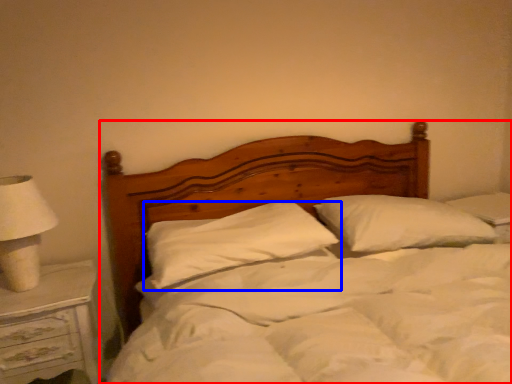
Question: Among these objects, which one is farthest to the camera, bed (highlighted by a red box) or pillow (highlighted by a blue box)?

Choices:
 (A) bed
 (B) pillow

Answer: (B)